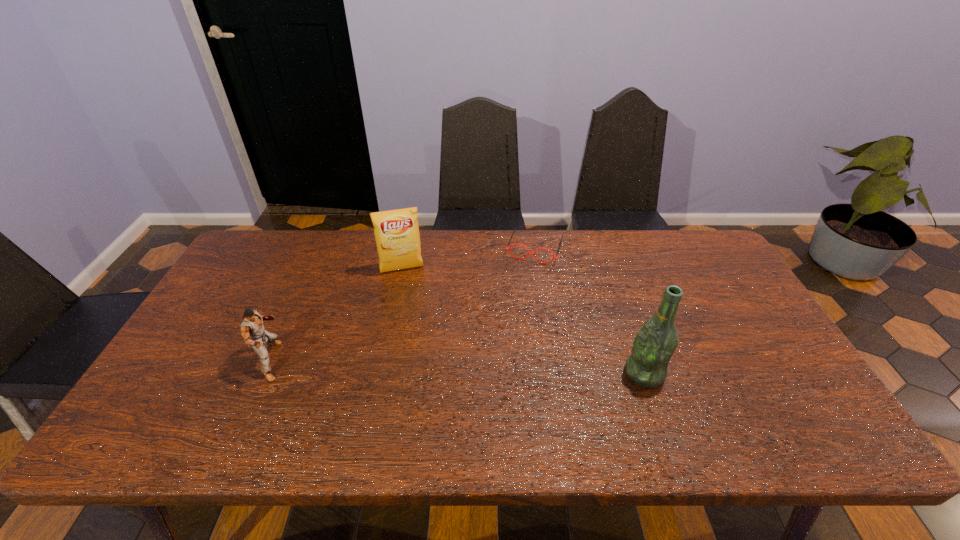
The width and height of the screenshot is (960, 540). In order to click on unoccupied area between the third tallest object and the third object from right to left in this screenshot , I will do `click(337, 315)`.

This screenshot has height=540, width=960. I want to click on blank region between the leftmost object and the shortest object, so click(403, 305).

At what (x,y) coordinates should I click in order to perform the action: click on vacant space in between the third object from right to left and the rightmost object. Please return your answer as a coordinate pair (x, y). Looking at the image, I should click on (523, 321).

Image resolution: width=960 pixels, height=540 pixels. I want to click on empty space that is in between the tallest object and the third shortest object, so click(x=523, y=321).

This screenshot has height=540, width=960. Identify the location of free space between the rightmost object and the shortest object. (589, 310).

You are a GUI agent. You are given a task and a screenshot of the screen. Output one action in this format:
    pyautogui.click(x=<x>, y=<y>)
    Task: Click on the object that stands as the second closest to the tallest object
    This screenshot has width=960, height=540.
    Given the screenshot: What is the action you would take?
    pyautogui.click(x=396, y=232)

Locate an element on the screen. The height and width of the screenshot is (540, 960). the closest object to the shortest object is located at coordinates (396, 232).

Find the location of a particular element. The width and height of the screenshot is (960, 540). free space that satisfies the following two spatial constraints: 1. on the front side of the crisp (potato chip); 2. on the surface of the beer bottle is located at coordinates (380, 373).

At what (x,y) coordinates should I click in order to perform the action: click on free region that satisfies the following two spatial constraints: 1. on the front side of the beer bottle; 2. on the surface of the second tallest object. Please return your answer as a coordinate pair (x, y). Looking at the image, I should click on tap(380, 373).